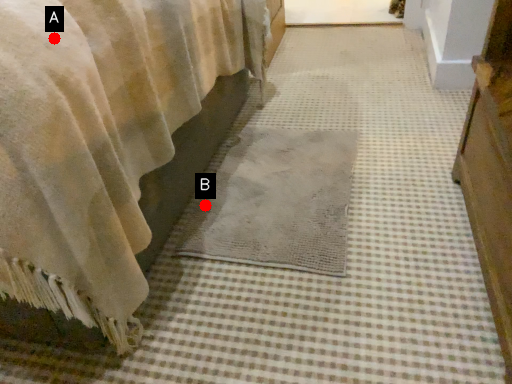
Question: Two points are circled on the image, labeled by A and B beside each circle. Which of the following is the farthest from the observer?

Choices:
 (A) A is further
 (B) B is further

Answer: (B)